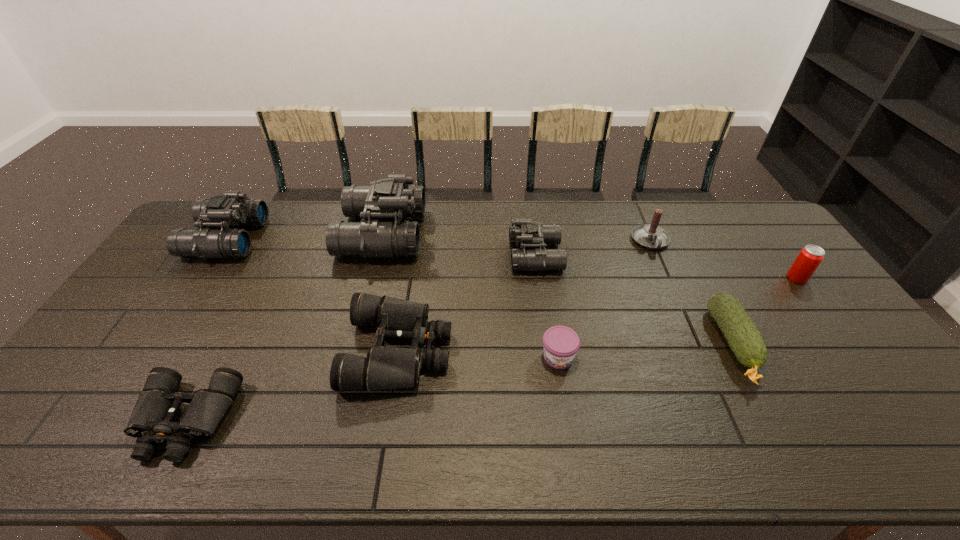
Find the location of `the biggest blue binoculars`. the biggest blue binoculars is located at coordinates (392, 198).

Find the location of `the tallest object`. the tallest object is located at coordinates (392, 198).

The width and height of the screenshot is (960, 540). Identify the location of the leftmost blue binoculars. (232, 209).

The height and width of the screenshot is (540, 960). Identify the location of the second smallest blue binoculars. (232, 209).

The image size is (960, 540). I want to click on candle, so click(651, 236).

At what (x,y) coordinates should I click in order to perform the action: click on the rightmost binoculars. Please return your answer as a coordinate pair (x, y). Image resolution: width=960 pixels, height=540 pixels. Looking at the image, I should click on (525, 232).

Locate an element on the screen. the smallest blue binoculars is located at coordinates (525, 232).

Identify the location of the rightmost object. (810, 257).

I want to click on red can, so click(x=810, y=257).

Find the location of a particular element. Image resolution: width=960 pixels, height=540 pixels. the second shortest binoculars is located at coordinates (384, 367).